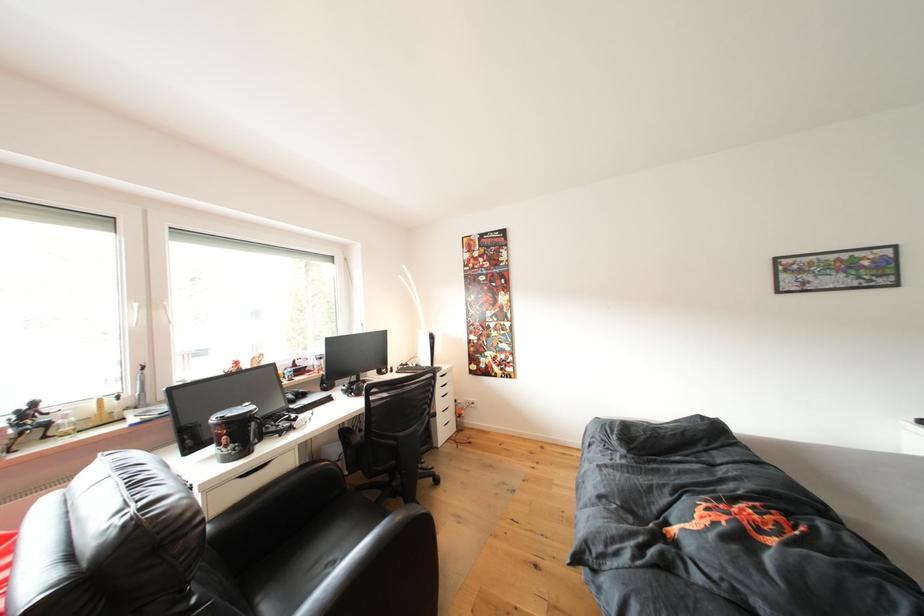
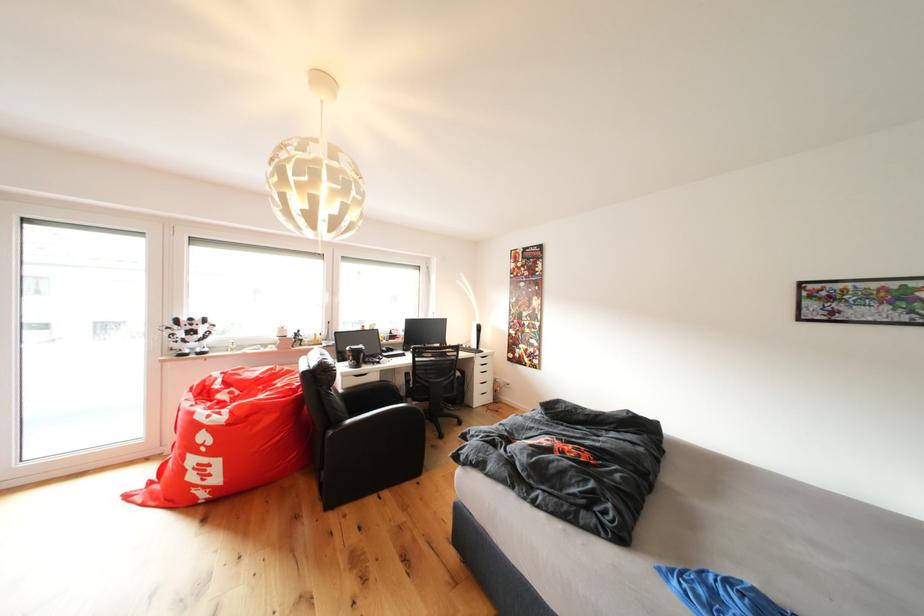
In the second image, find the point that corresponds to [310,471] in the first image.

(390, 387)